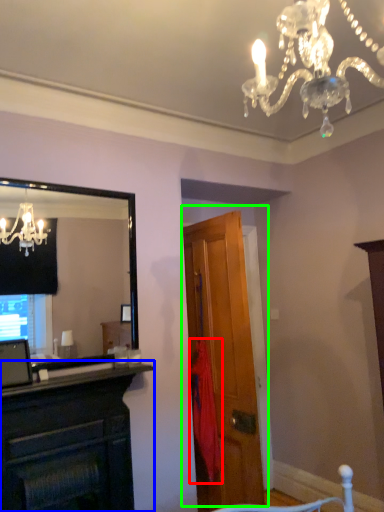
Question: Which object is the farthest from curtain (highlighted by a red box)? Choose among these: cabinetry (highlighted by a blue box) or door (highlighted by a green box).

Choices:
 (A) cabinetry
 (B) door

Answer: (A)